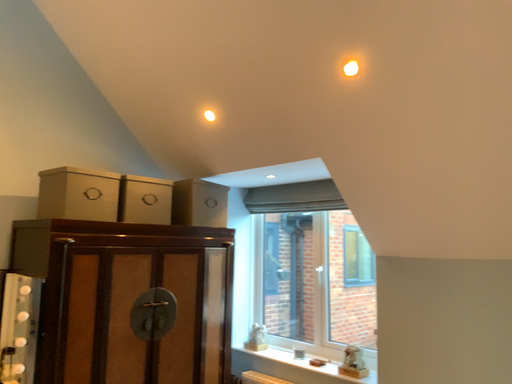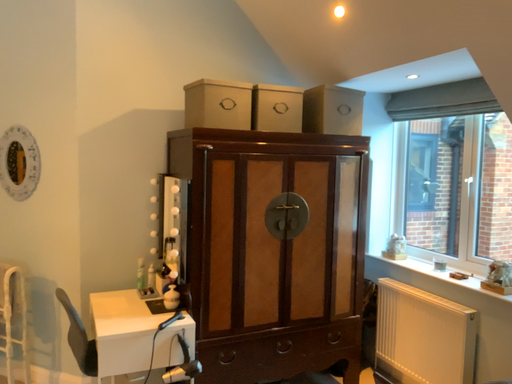
Question: How did the camera likely rotate when shooting the video?

Choices:
 (A) rotated downward
 (B) rotated upward

Answer: (A)